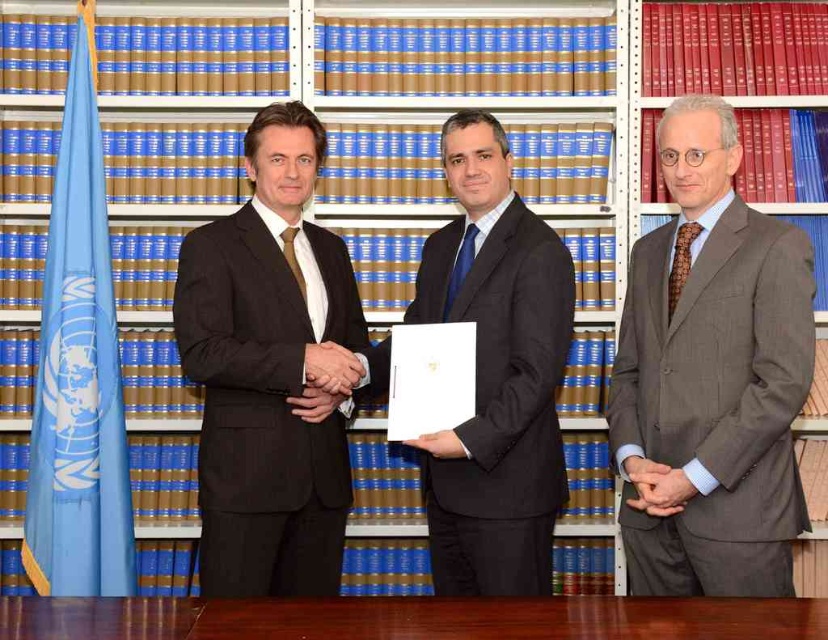
Can you confirm if dark gray suit at center is thinner than brown wooden table at center?

Yes.

Can you confirm if dark gray suit at center is positioned above brown wooden table at center?

Indeed, dark gray suit at center is positioned over brown wooden table at center.

Between point (441, 480) and point (307, 634), which one is positioned in front?

Point (307, 634) is in front.

Locate an element on the screen. The height and width of the screenshot is (640, 828). dark gray suit at center is located at coordinates (496, 372).

Is black satin suit at center to the right of smooth leather wallet at center from the viewer's perspective?

No, black satin suit at center is not to the right of smooth leather wallet at center.

Can you confirm if black satin suit at center is taller than smooth leather wallet at center?

Yes.

What do you see at coordinates (268, 372) in the screenshot? Image resolution: width=828 pixels, height=640 pixels. I see `black satin suit at center` at bounding box center [268, 372].

At what (x,y) coordinates should I click in order to perform the action: click on black satin suit at center. Please return your answer as a coordinate pair (x, y). Image resolution: width=828 pixels, height=640 pixels. Looking at the image, I should click on (268, 372).

Does gray pinstripe suit at right have a greater height compared to smooth leather hand at center?

Yes, gray pinstripe suit at right is taller than smooth leather hand at center.

Which is below, gray pinstripe suit at right or smooth leather hand at center?

smooth leather hand at center is below.

Where is `gray pinstripe suit at right`? The width and height of the screenshot is (828, 640). gray pinstripe suit at right is located at coordinates (713, 372).

Where is `gray pinstripe suit at right`? The width and height of the screenshot is (828, 640). gray pinstripe suit at right is located at coordinates (713, 372).